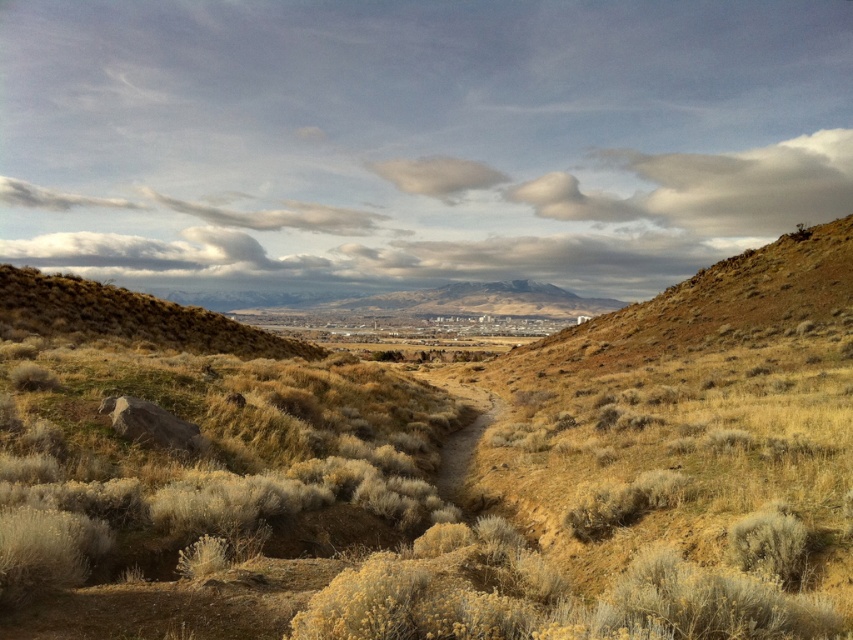
Who is lower down, white fluffy cloud at upper center or brown dirt path at center?

brown dirt path at center is below.

Does white fluffy cloud at upper center have a greater width compared to brown dirt path at center?

Yes, white fluffy cloud at upper center is wider than brown dirt path at center.

Is point (485, 173) more distant than point (469, 428)?

Yes.

The width and height of the screenshot is (853, 640). Identify the location of white fluffy cloud at upper center. (437, 176).